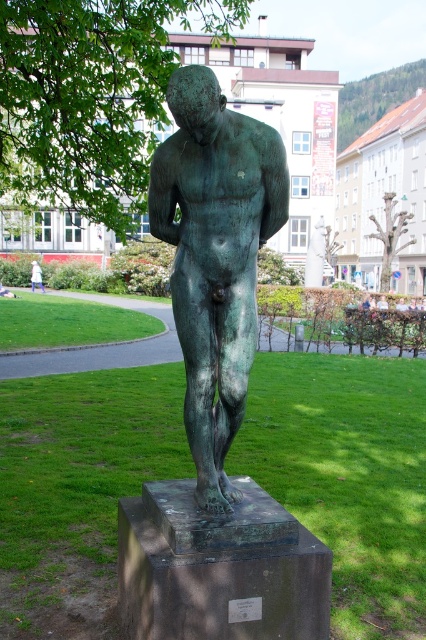
You are a park visitor who wants to take a photo of the bronze statue. You notice two trees in the background that might block your view. Which tree, the green leafy tree at upper center or the green textured tree at center, is taller and more likely to obstruct the statue in your photo?

The green leafy tree at upper center is taller than the green textured tree at center, so it is more likely to obstruct the statue in your photo.

You are a park visitor who wants to take a photo of the green patina statue at center without any obstructions. However, there is a white cotton shirt at lower left in the way. Based on their positions, can you stand in a spot where the statue is visible while avoiding the shirt?

The green patina statue at center is located below the white cotton shirt at lower left. Since the statue is positioned lower than the shirt, you can stand behind the shirt or move to the side to capture the statue without obstruction.

You are standing at the base of the bronze statue and want to take a photo of the green leafy tree at upper left. If your camera can focus on objects up to 6 meters away, will you need to move closer to the tree to take a clear picture?

The distance between the green leafy tree at upper left and the camera is 6.60 meters. Since the camera can focus up to 6 meters, you need to move closer to the tree to ensure it is within the camera range.